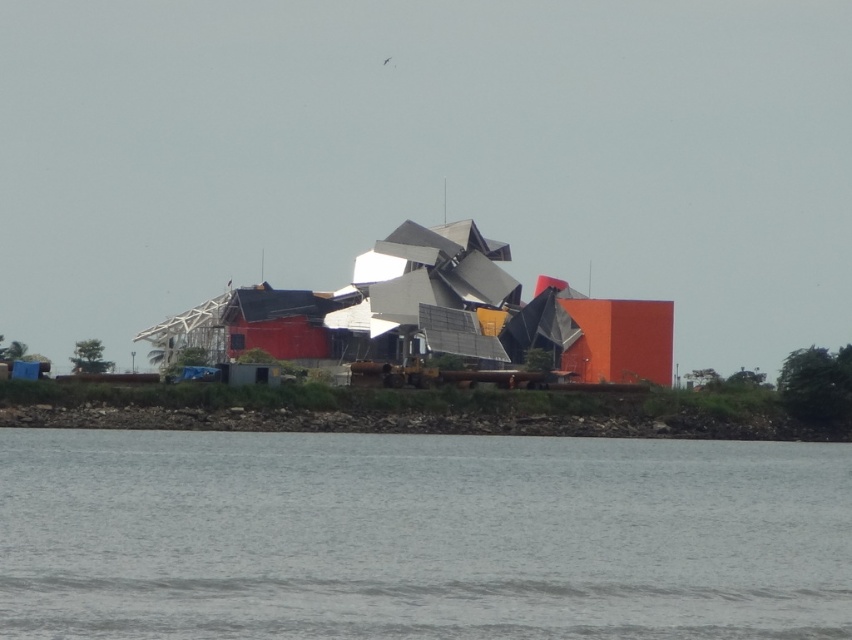
Does gray water at lower center have a lesser height compared to brown dirt at lower center?

Incorrect, gray water at lower center's height does not fall short of brown dirt at lower center's.

Where is `gray water at lower center`? This screenshot has height=640, width=852. gray water at lower center is located at coordinates (419, 536).

Identify the location of gray water at lower center. (419, 536).